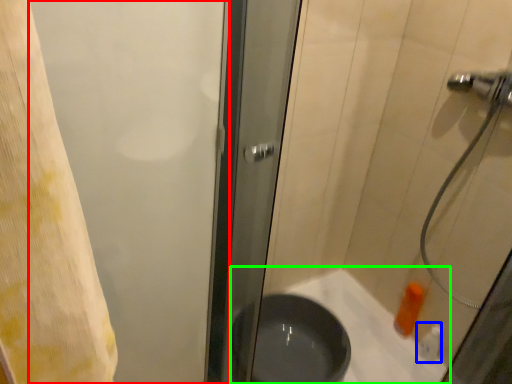
Question: Which object is positioned closest to screen door (highlighted by a red box)? Select from toiletry (highlighted by a blue box) and bath (highlighted by a green box).

Choices:
 (A) toiletry
 (B) bath

Answer: (B)